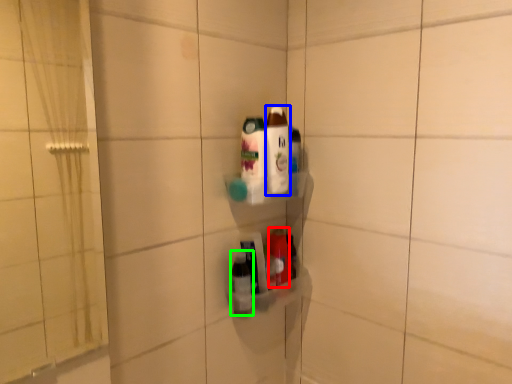
Question: Which object is positioned farthest from bottle (highlighted by a red box)? Select from bottle (highlighted by a blue box) and bottle (highlighted by a green box).

Choices:
 (A) bottle
 (B) bottle

Answer: (A)